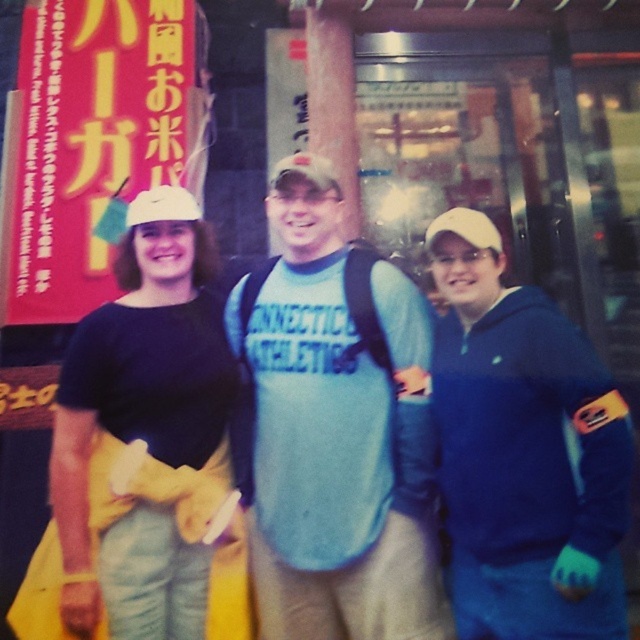
You are standing 2 meters away from the storefront. There is a point at coordinates point (385, 509). Can you reach it without moving closer than 1.5 meters from your current position?

The distance of point (385, 509) from viewer is 1.69 meters. Since you are currently 2 meters away and need to stay at least 1.5 meters away, you can reach it as 1.69 meters is between 1.5 and 2 meters.

Consider the image. You are a photographer trying to capture a clear shot of the blue fleece jacket at center and the white matte baseball cap at center. Which object should you focus on first to ensure both are in focus?

The blue fleece jacket at center is closer to the viewer than the white matte baseball cap at center, so focus on the blue fleece jacket at center first to ensure both are in focus.